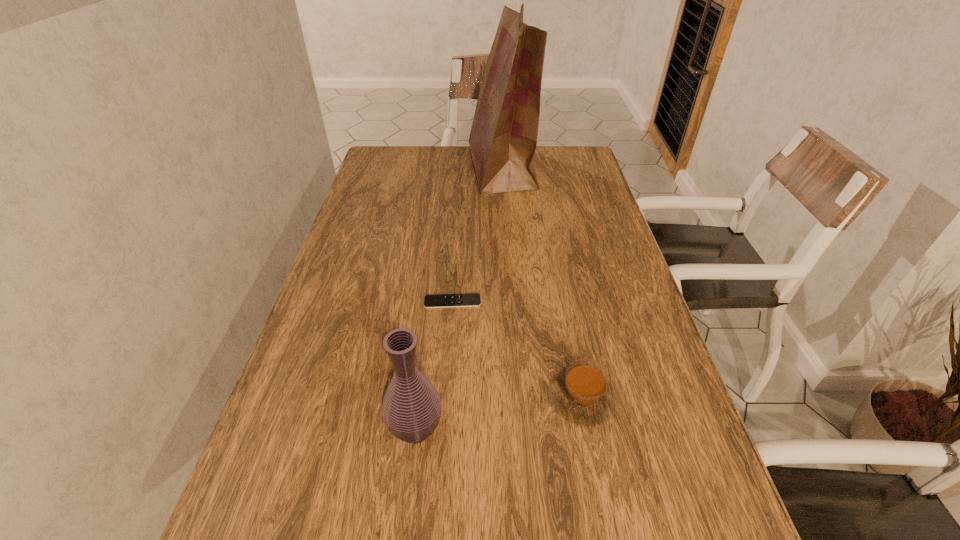
Identify the location of the farthest object. This screenshot has width=960, height=540. (503, 138).

At what (x,y) coordinates should I click in order to perform the action: click on grocery bag. Please return your answer as a coordinate pair (x, y). Image resolution: width=960 pixels, height=540 pixels. Looking at the image, I should click on (503, 138).

The width and height of the screenshot is (960, 540). Find the location of `vase`. vase is located at coordinates (411, 406).

The height and width of the screenshot is (540, 960). In order to click on cappuccino in this screenshot , I will do `click(582, 394)`.

Locate an element on the screen. The image size is (960, 540). remote control is located at coordinates (467, 299).

Where is `the second farthest object`? The width and height of the screenshot is (960, 540). the second farthest object is located at coordinates (467, 299).

This screenshot has width=960, height=540. Identify the location of vacant space located on the front-facing side of the farthest object. (410, 170).

Image resolution: width=960 pixels, height=540 pixels. In order to click on vacant space located on the front-facing side of the farthest object in this screenshot , I will do `click(416, 170)`.

In order to click on free space located 0.100m on the front-facing side of the farthest object in this screenshot , I will do `click(439, 170)`.

Find the location of a particular element. The image size is (960, 540). vacant space located on the back of the vase is located at coordinates (421, 378).